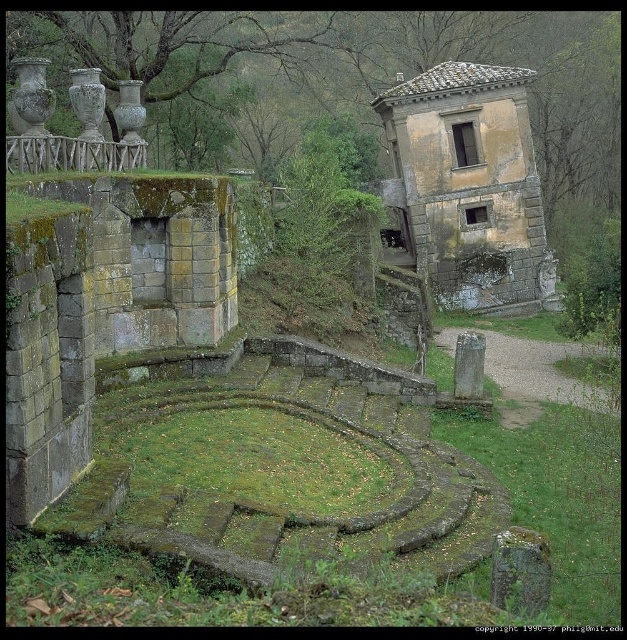
You are standing in front of the old stone structure and want to reach the green mossy stone at center. Which direction should you move relative to the yellow stone amphitheater at center?

Since the yellow stone amphitheater at center is closer to you than the green mossy stone at center, you should move forward past the yellow stone amphitheater at center to reach the green mossy stone at center.

You are an archaeologist examining the old stone structure. You notice the yellow stone amphitheater at center and the green mossy stone at center. Which object is larger in size?

The green mossy stone at center is larger than the yellow stone amphitheater at center.

You are a landscape architect designing a garden path that must pass between the yellow stone amphitheater at center and the green mossy stone at center. Given that the path needs to be 2 meters wide, can the existing space accommodate this requirement?

The yellow stone amphitheater at center has a lesser width compared to green mossy stone at center. However, the description does not provide specific measurements of their widths or the distance between them. Without knowing the exact dimensions, it is impossible to determine if the 2 meter wide path can fit between them.